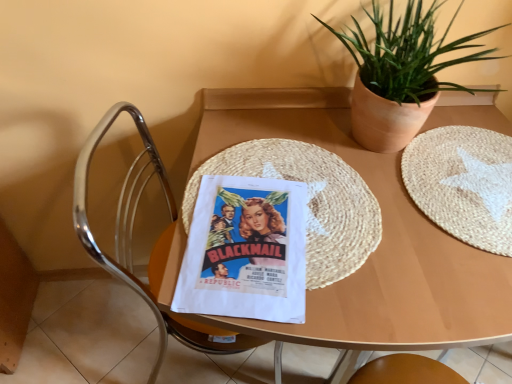
Locate an element on the screen. The width and height of the screenshot is (512, 384). free space to the left of green leafy plant in clay pot at upper right is located at coordinates 270,145.